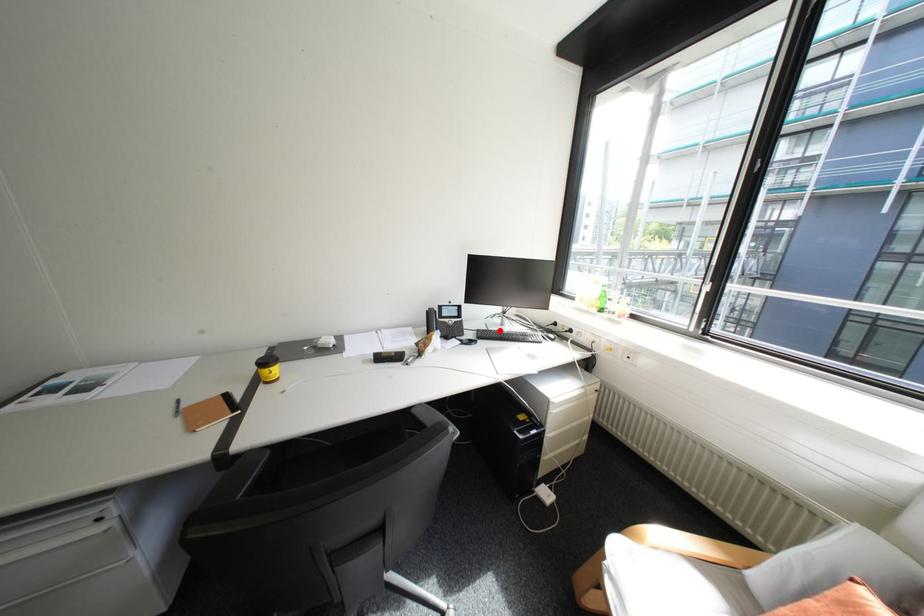
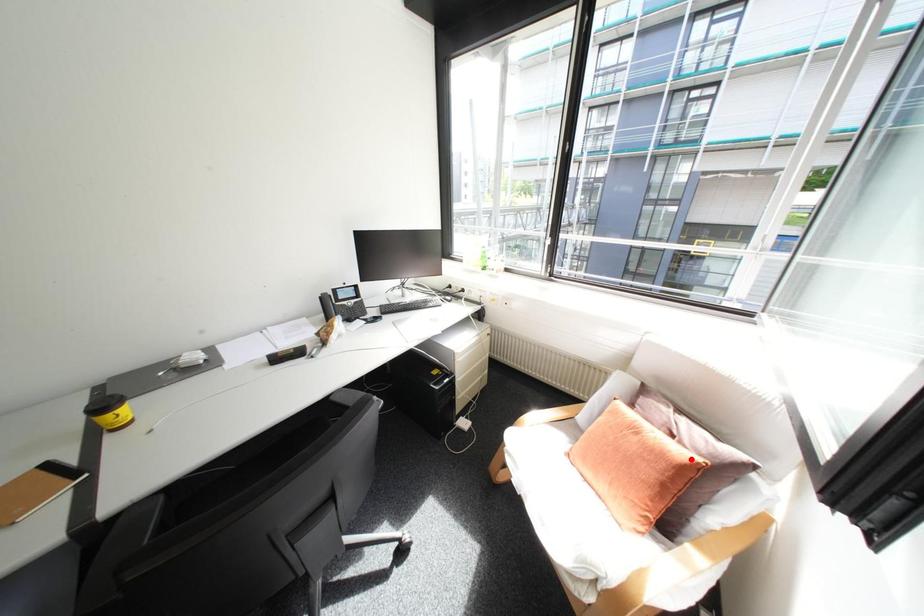
I am providing you with two images of the same scene from different viewpoints. A red point is marked on the first image and another point is marked on the second image. Are the points marked in image1 and image2 representing the same 3D position?

No